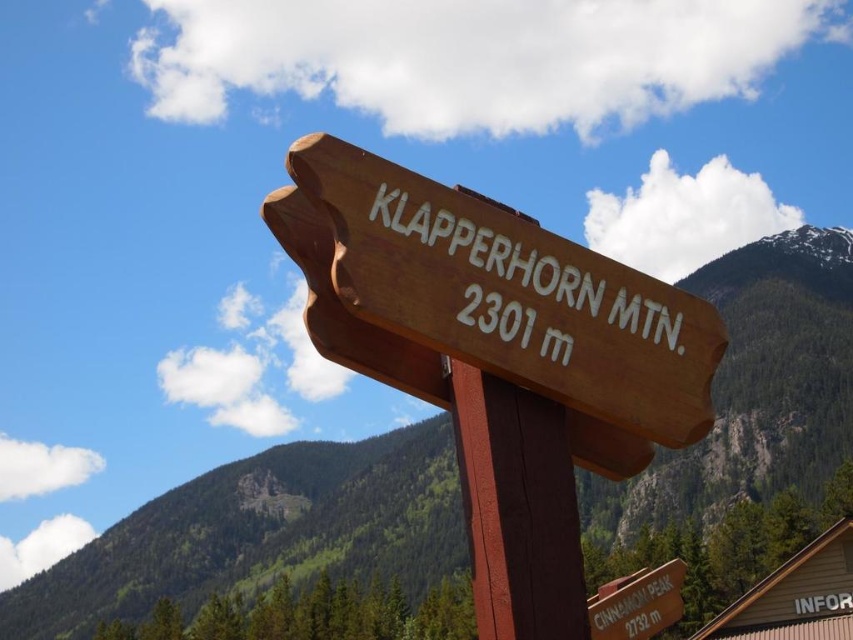
Is wooden signpost at center thinner than brown wooden signpost at center?

In fact, wooden signpost at center might be wider than brown wooden signpost at center.

Between point (279, 544) and point (569, 595), which one is positioned behind?

Positioned behind is point (279, 544).

At what (x,y) coordinates should I click in order to perform the action: click on wooden signpost at center. Please return your answer as a coordinate pair (x, y). The width and height of the screenshot is (853, 640). Looking at the image, I should click on (260, 532).

Is brown wooden signpost at center thinner than orange wood sign at lower right?

Correct, brown wooden signpost at center's width is less than orange wood sign at lower right's.

At what (x,y) coordinates should I click in order to perform the action: click on brown wooden signpost at center. Please return your answer as a coordinate pair (x, y). The height and width of the screenshot is (640, 853). Looking at the image, I should click on (517, 508).

Which is behind, point (479, 589) or point (627, 628)?

The point (627, 628) is more distant.

Where is `brown wooden signpost at center`? brown wooden signpost at center is located at coordinates (517, 508).

Who is more distant from viewer, (236,582) or (602,269)?

Positioned behind is point (236,582).

The height and width of the screenshot is (640, 853). In order to click on wooden signpost at center in this screenshot , I will do `click(260, 532)`.